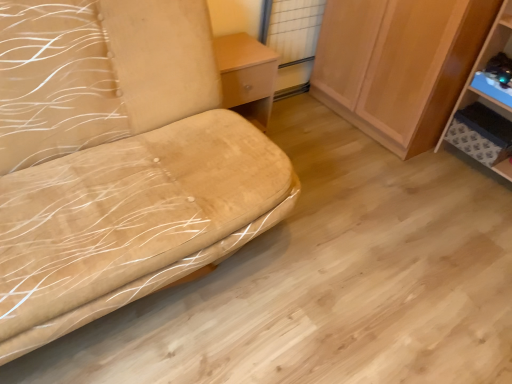
This screenshot has height=384, width=512. Find the location of `vacant space in between suede-like beige sofa at left and wooden cabinet at right`. vacant space in between suede-like beige sofa at left and wooden cabinet at right is located at coordinates (328, 162).